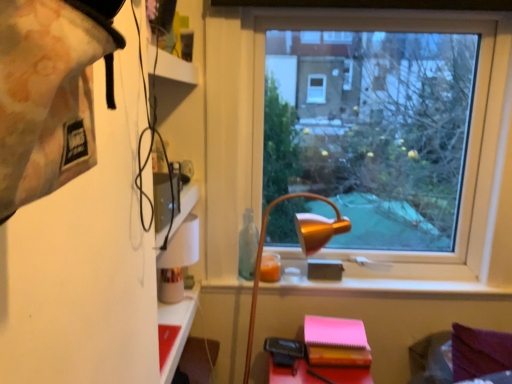
Question: Is transparent glass window at center further to camera compared to matte red table at lower left?

Choices:
 (A) no
 (B) yes

Answer: (B)

Question: Considering the relative sizes of transparent glass window at center and matte red table at lower left in the image provided, is transparent glass window at center shorter than matte red table at lower left?

Choices:
 (A) yes
 (B) no

Answer: (B)

Question: Is matte red table at lower left located within transparent glass window at center?

Choices:
 (A) no
 (B) yes

Answer: (A)

Question: Does transparent glass window at center appear on the left side of matte red table at lower left?

Choices:
 (A) no
 (B) yes

Answer: (A)

Question: From the image's perspective, would you say transparent glass window at center is positioned over matte red table at lower left?

Choices:
 (A) yes
 (B) no

Answer: (A)

Question: Considering the relative sizes of transparent glass window at center and matte red table at lower left in the image provided, is transparent glass window at center bigger than matte red table at lower left?

Choices:
 (A) no
 (B) yes

Answer: (B)

Question: Considering the relative positions of gold metallic lamp at center and transparent glass window at center in the image provided, is gold metallic lamp at center to the right of transparent glass window at center from the viewer's perspective?

Choices:
 (A) yes
 (B) no

Answer: (B)

Question: Does gold metallic lamp at center have a lesser width compared to transparent glass window at center?

Choices:
 (A) yes
 (B) no

Answer: (B)

Question: From the image's perspective, does gold metallic lamp at center appear lower than transparent glass window at center?

Choices:
 (A) yes
 (B) no

Answer: (A)

Question: Is transparent glass window at center surrounded by gold metallic lamp at center?

Choices:
 (A) no
 (B) yes

Answer: (A)

Question: Does gold metallic lamp at center have a greater height compared to transparent glass window at center?

Choices:
 (A) no
 (B) yes

Answer: (A)

Question: Is gold metallic lamp at center positioned behind transparent glass window at center?

Choices:
 (A) yes
 (B) no

Answer: (B)

Question: Is matte red table at lower left to the right of pink matte notebook at lower right from the viewer's perspective?

Choices:
 (A) yes
 (B) no

Answer: (B)